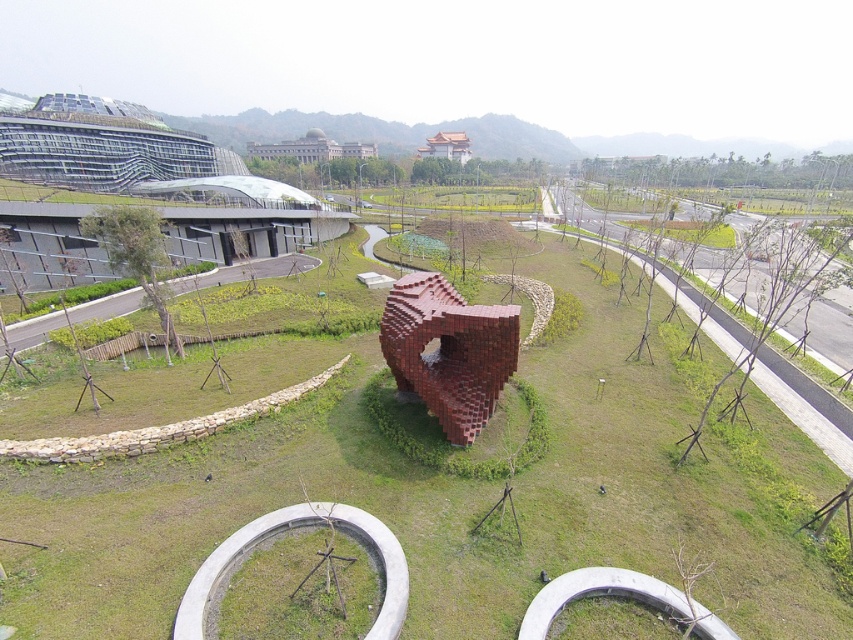
From the picture: You are standing in the urban park and notice the green grassy at center and the brick heart at center. Which object is located below the other?

The green grassy at center is positioned under brick heart at center, meaning the green grassy is below the brick heart.

You are a gardener planning to plant flowers around the green grassy at center and the brick heart at center. Which area has more space available for planting flowers?

The green grassy at center has more space available for planting flowers since it is bigger than the brick heart at center.

You are standing at the point with coordinates (424, 499) in the urban landscape. What type of terrain are you currently standing on?

The point at coordinates (424, 499) indicates green grassy at center, so you are standing on green grassy terrain.